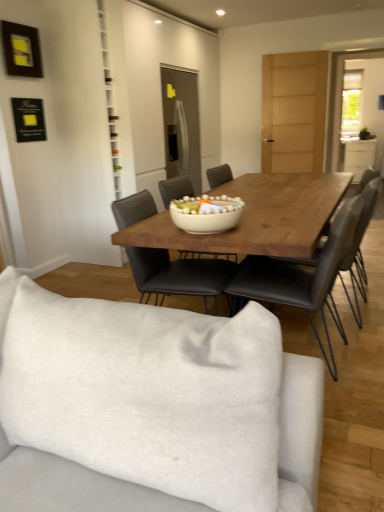
Question: Is white glossy bowl at center a part of white fabric studio couch at lower center?

Choices:
 (A) yes
 (B) no

Answer: (B)

Question: Does white fabric studio couch at lower center appear on the right side of white glossy bowl at center?

Choices:
 (A) yes
 (B) no

Answer: (B)

Question: Does white fabric studio couch at lower center have a greater height compared to white glossy bowl at center?

Choices:
 (A) yes
 (B) no

Answer: (A)

Question: Could you tell me if white fabric studio couch at lower center is facing white glossy bowl at center?

Choices:
 (A) no
 (B) yes

Answer: (A)

Question: Can you confirm if white fabric studio couch at lower center is wider than white glossy bowl at center?

Choices:
 (A) yes
 (B) no

Answer: (A)

Question: From the image's perspective, relative to clear glass door at upper right, is white fabric studio couch at lower center above or below?

Choices:
 (A) below
 (B) above

Answer: (A)

Question: Is white fabric studio couch at lower center bigger or smaller than clear glass door at upper right?

Choices:
 (A) big
 (B) small

Answer: (A)

Question: Is white fabric studio couch at lower center taller or shorter than clear glass door at upper right?

Choices:
 (A) short
 (B) tall

Answer: (A)

Question: Does point (105, 371) appear closer or farther from the camera than point (332, 141)?

Choices:
 (A) closer
 (B) farther

Answer: (A)

Question: Choose the correct answer: Is clear glass door at upper right inside white glossy cabinet at right or outside it?

Choices:
 (A) outside
 (B) inside

Answer: (A)

Question: Is clear glass door at upper right taller or shorter than white glossy cabinet at right?

Choices:
 (A) short
 (B) tall

Answer: (B)

Question: Looking at the image, does clear glass door at upper right seem bigger or smaller compared to white glossy cabinet at right?

Choices:
 (A) big
 (B) small

Answer: (B)

Question: Looking at their shapes, would you say clear glass door at upper right is wider or thinner than white glossy cabinet at right?

Choices:
 (A) wide
 (B) thin

Answer: (B)

Question: Based on their positions, is clear glass door at upper right located to the left or right of white fabric studio couch at lower center?

Choices:
 (A) left
 (B) right

Answer: (B)

Question: Is clear glass door at upper right in front of or behind white fabric studio couch at lower center in the image?

Choices:
 (A) front
 (B) behind

Answer: (B)